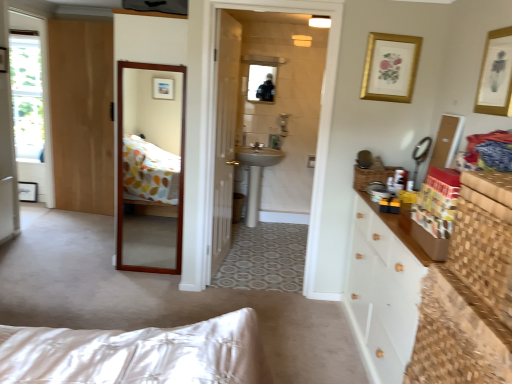
You are a GUI agent. You are given a task and a screenshot of the screen. Output one action in this format:
    pyautogui.click(x=<x>, y=<y>)
    Task: Click on the blank area beneath white ceramic sink at center (from a real-world perspective)
    The image size is (512, 384).
    Given the screenshot: What is the action you would take?
    pyautogui.click(x=259, y=228)